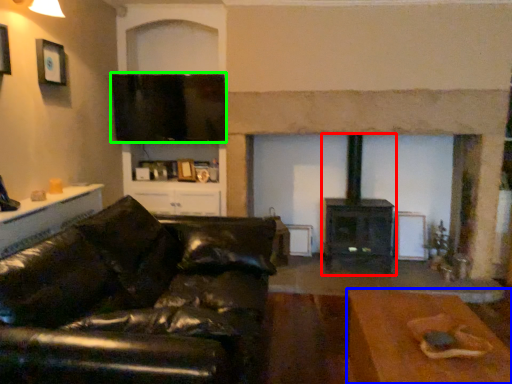
Question: Which object is positioned closest to wood burning stove (highlighted by a red box)? Select from table (highlighted by a blue box) and window screen (highlighted by a green box).

Choices:
 (A) table
 (B) window screen

Answer: (B)